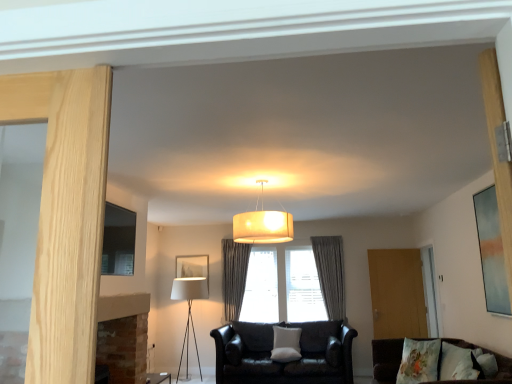
Question: From the image's perspective, is white fabric picture frame at center, which ranks as the 3th picture frame in front-to-back order, beneath fluffy cotton pillow at lower right, which ranks as the second pillow in front-to-back order?

Choices:
 (A) no
 (B) yes

Answer: (A)

Question: From a real-world perspective, is white fabric picture frame at center, the 2th picture frame positioned from the left, beneath fluffy cotton pillow at lower right, the first pillow viewed from the right?

Choices:
 (A) yes
 (B) no

Answer: (B)

Question: Considering the relative sizes of white fabric picture frame at center, which ranks as the 3th picture frame in front-to-back order, and fluffy cotton pillow at lower right, the second pillow viewed from the back, in the image provided, is white fabric picture frame at center, which ranks as the 3th picture frame in front-to-back order, smaller than fluffy cotton pillow at lower right, the second pillow viewed from the back,?

Choices:
 (A) no
 (B) yes

Answer: (B)

Question: Is white fabric picture frame at center, which is counted as the second picture frame, starting from the right, in front of fluffy cotton pillow at lower right, which ranks as the second pillow in front-to-back order?

Choices:
 (A) yes
 (B) no

Answer: (B)

Question: Is white fabric picture frame at center, which ranks as the 3th picture frame in front-to-back order, far from fluffy cotton pillow at lower right, the first pillow viewed from the right?

Choices:
 (A) yes
 (B) no

Answer: (A)

Question: Considering the positions of velvet brown couch at lower right, marked as the second studio couch in a back-to-front arrangement, and wooden screen door at right in the image, is velvet brown couch at lower right, marked as the second studio couch in a back-to-front arrangement, taller or shorter than wooden screen door at right?

Choices:
 (A) short
 (B) tall

Answer: (A)

Question: Considering the relative positions of velvet brown couch at lower right, marked as the second studio couch in a back-to-front arrangement, and wooden screen door at right in the image provided, is velvet brown couch at lower right, marked as the second studio couch in a back-to-front arrangement, to the left or to the right of wooden screen door at right?

Choices:
 (A) right
 (B) left

Answer: (B)

Question: Is velvet brown couch at lower right, marked as the second studio couch in a back-to-front arrangement, wider or thinner than wooden screen door at right?

Choices:
 (A) thin
 (B) wide

Answer: (B)

Question: From the image's perspective, is velvet brown couch at lower right, the first studio couch viewed from the front, located above or below wooden screen door at right?

Choices:
 (A) below
 (B) above

Answer: (A)

Question: Is matte black picture frame at left, which is the 3th picture frame from right to left, situated inside white fabric pillow at center, the third pillow when ordered from front to back, or outside?

Choices:
 (A) inside
 (B) outside

Answer: (B)

Question: From the image's perspective, is matte black picture frame at left, which is the 3th picture frame from right to left, positioned above or below white fabric pillow at center, the first pillow positioned from the left?

Choices:
 (A) above
 (B) below

Answer: (A)

Question: From their relative heights in the image, would you say matte black picture frame at left, arranged as the 2th picture frame when viewed from the back, is taller or shorter than white fabric pillow at center, the 3th pillow in the top-to-bottom sequence?

Choices:
 (A) short
 (B) tall

Answer: (B)

Question: From a real-world perspective, relative to white fabric pillow at center, the third pillow when ordered from front to back, is matte black picture frame at left, which is the 3th picture frame from right to left, vertically above or below?

Choices:
 (A) below
 (B) above

Answer: (B)

Question: From a real-world perspective, is wooden screen door at right physically located above or below gray textured curtain at center, the first curtain from the right?

Choices:
 (A) below
 (B) above

Answer: (A)

Question: From the image's perspective, is wooden screen door at right located above or below gray textured curtain at center, the first curtain from the right?

Choices:
 (A) below
 (B) above

Answer: (A)